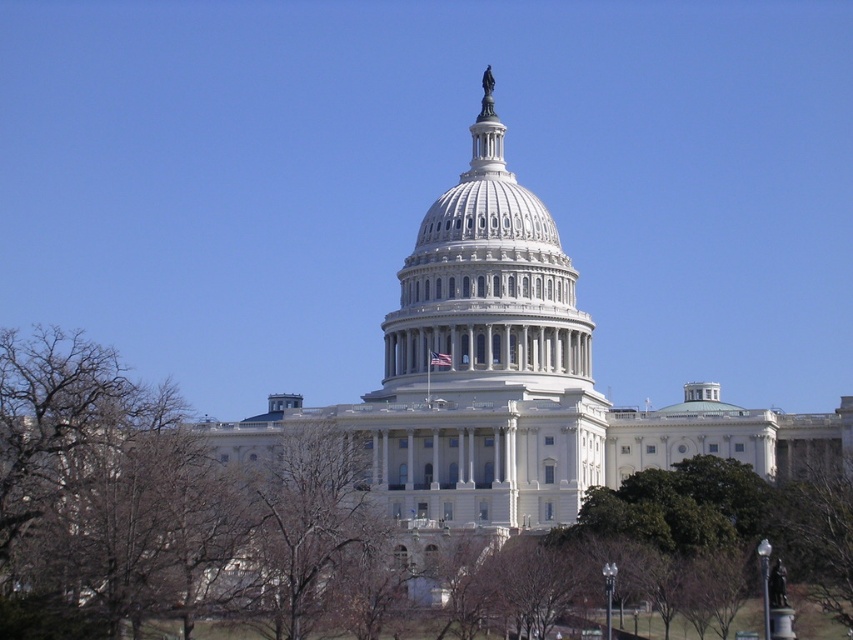
You are standing 200 feet away from the brown leafless tree at lower left. Can you see the United States Capitol Building from your current position?

The brown leafless tree at lower left and viewer are 203.00 feet apart, so you are standing slightly further away than 200 feet. Therefore, you might not be able to see the United States Capitol Building clearly from your current position.

You are standing at the point marked by the coordinate point at (357, 480). Looking towards the United States Capitol Building, which direction should you face to see the brown leafless tree at lower left?

Since the brown leafless tree at lower left is represented by the coordinate point at (357, 480), you are already at the location of the tree. Therefore, you would need to turn around to face away from the Capitol Building to see the tree behind you.